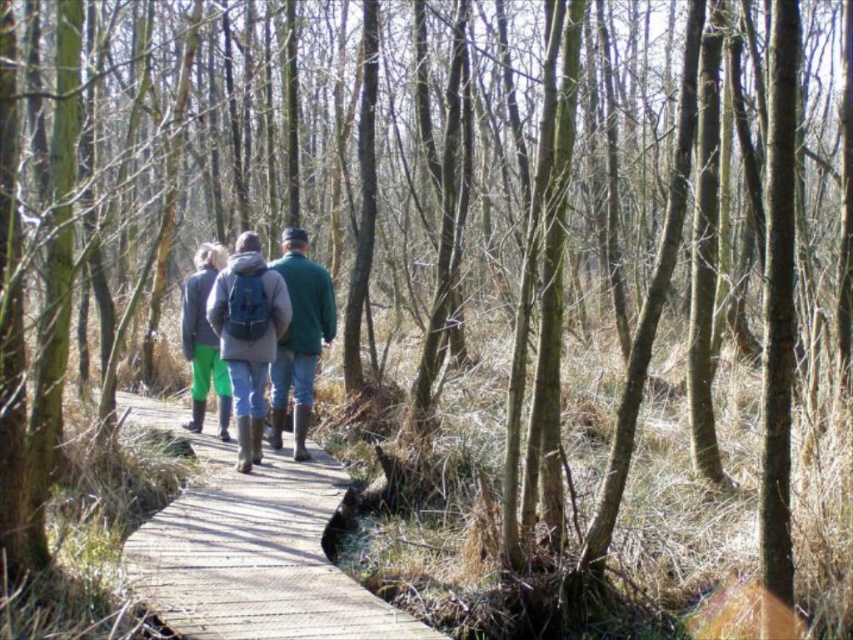
Question: Which point is closer to the camera?

Choices:
 (A) green matte jacket at center
 (B) wooden at center

Answer: (B)

Question: Is wooden at center below green rubber boots at center?

Choices:
 (A) yes
 (B) no

Answer: (A)

Question: Which point is farther to the camera?

Choices:
 (A) green rubber boots at center
 (B) green matte jacket at center
 (C) green fabric jacket at center
 (D) wooden at center

Answer: (A)

Question: Does wooden at center have a larger size compared to green matte jacket at center?

Choices:
 (A) yes
 (B) no

Answer: (B)

Question: Can you confirm if wooden at center is positioned above green matte jacket at center?

Choices:
 (A) no
 (B) yes

Answer: (A)

Question: Which point is farther from the camera taking this photo?

Choices:
 (A) (271, 538)
 (B) (196, 276)
 (C) (310, 378)

Answer: (B)